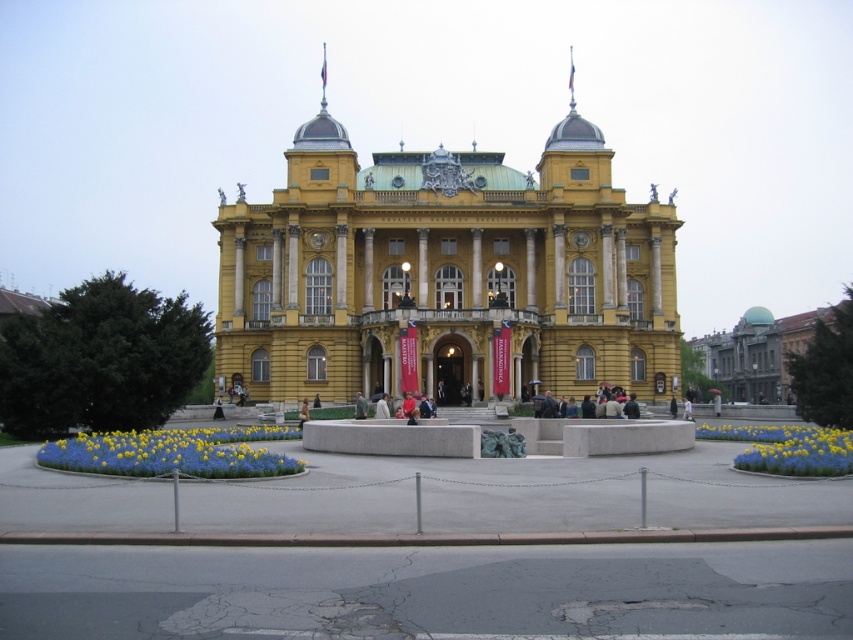
Image resolution: width=853 pixels, height=640 pixels. Describe the element at coordinates (757, 353) in the screenshot. I see `dark gray stone building at center` at that location.

Is point (810, 326) less distant than point (770, 461)?

No, (810, 326) is further to viewer.

In order to click on dark gray stone building at center in this screenshot , I will do `click(757, 353)`.

Is blue matte flowers at lower left above light brown leather jacket at center?

Incorrect, blue matte flowers at lower left is not positioned above light brown leather jacket at center.

Can you confirm if blue matte flowers at lower left is smaller than light brown leather jacket at center?

No, blue matte flowers at lower left is not smaller than light brown leather jacket at center.

Does point (190, 445) come in front of point (302, 410)?

Yes, point (190, 445) is closer to viewer.

You are a GUI agent. You are given a task and a screenshot of the screen. Output one action in this format:
    pyautogui.click(x=<x>, y=<y>)
    Task: Click on the blue matte flowers at lower left
    
    Given the screenshot: What is the action you would take?
    pyautogui.click(x=173, y=452)

Consider the image. Which of these two, blue matte flowers at lower right or black fabric person at center, stands taller?

With more height is blue matte flowers at lower right.

Where is `blue matte flowers at lower right`? blue matte flowers at lower right is located at coordinates (798, 451).

Locate an element on the screen. The height and width of the screenshot is (640, 853). blue matte flowers at lower right is located at coordinates (798, 451).